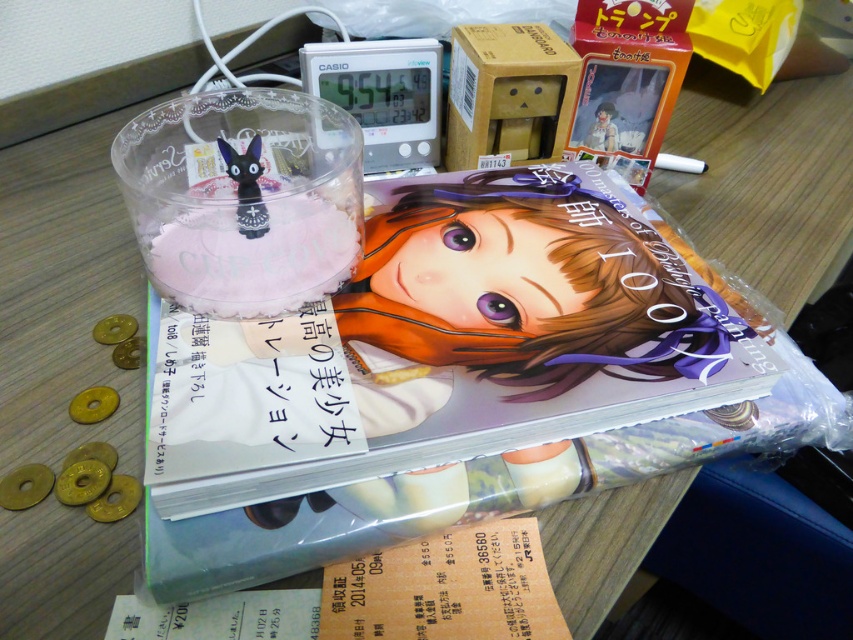
Is matte black cat figurine at upper left further to the viewer compared to matte plastic figurine at upper right?

No, it is not.

Which is behind, point (260, 230) or point (611, 141)?

The point (611, 141) is behind.

Where is `matte black cat figurine at upper left`? matte black cat figurine at upper left is located at coordinates (247, 186).

Can you confirm if yellow matte coin at lower left is positioned to the right of matte plastic figurine at upper right?

In fact, yellow matte coin at lower left is to the left of matte plastic figurine at upper right.

Where is `yellow matte coin at lower left`? The height and width of the screenshot is (640, 853). yellow matte coin at lower left is located at coordinates (93, 404).

Is point (93, 419) farther from camera compared to point (612, 104)?

No, it is not.

This screenshot has height=640, width=853. I want to click on yellow matte coin at lower left, so click(93, 404).

Can you confirm if matte black cat figurine at upper left is positioned to the right of yellow matte coin at lower left?

Correct, you'll find matte black cat figurine at upper left to the right of yellow matte coin at lower left.

In the scene shown: Does matte black cat figurine at upper left have a larger size compared to yellow matte coin at lower left?

Correct, matte black cat figurine at upper left is larger in size than yellow matte coin at lower left.

Does point (250, 141) come in front of point (76, 416)?

No, it is behind (76, 416).

Locate an element on the screen. This screenshot has width=853, height=640. matte black cat figurine at upper left is located at coordinates (247, 186).